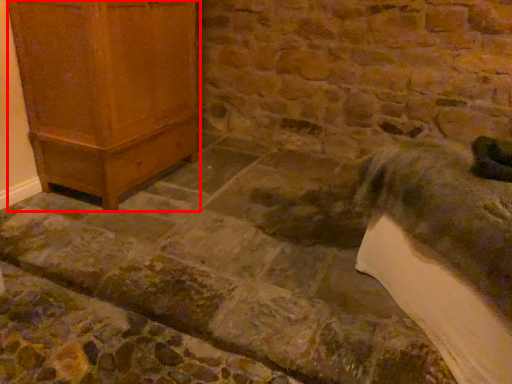
Question: From the image's perspective, what is the correct spatial positioning of furniture (annotated by the red box) in reference to animal?

Choices:
 (A) below
 (B) above

Answer: (B)